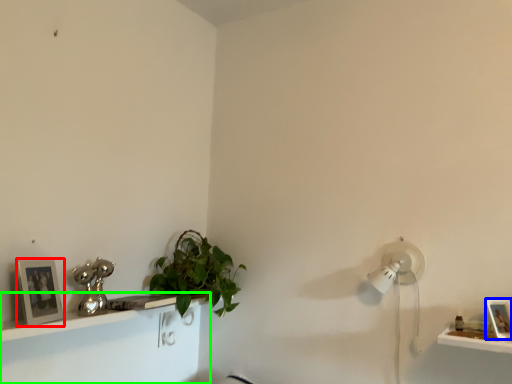
Question: Which is nearer to the picture frame (highlighted by a red box)? picture frame (highlighted by a blue box) or shelf (highlighted by a green box).

Choices:
 (A) picture frame
 (B) shelf

Answer: (B)